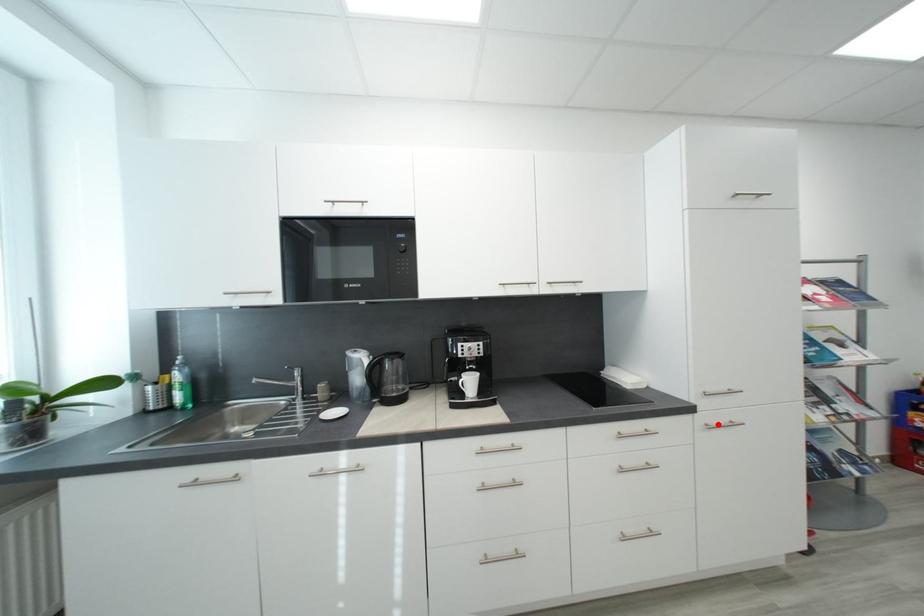
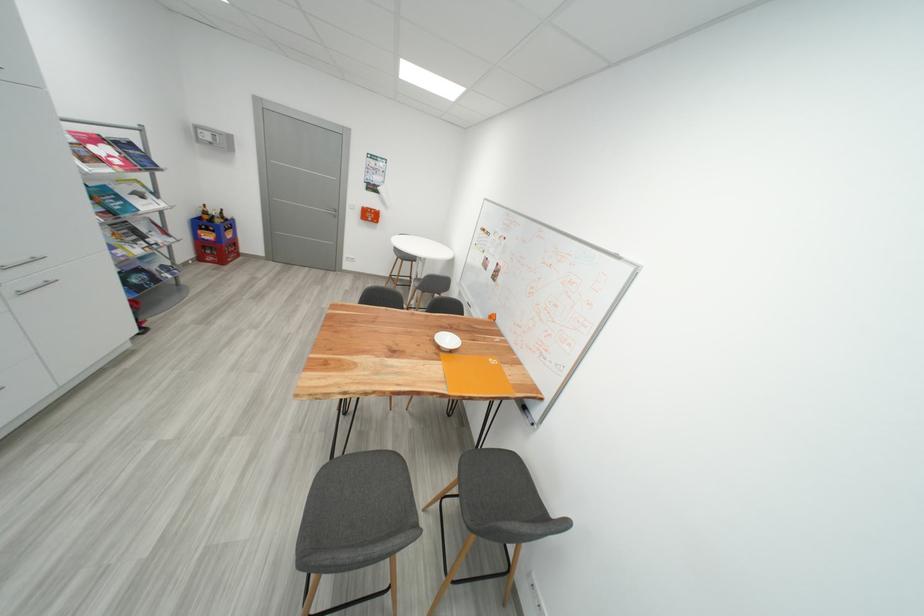
Question: I am providing you with two images of the same scene from different viewpoints. Image1 has a red point marked. In image2, the corresponding 3D location appears at what relative position? Reply with the corresponding letter.

Choices:
 (A) Closer
 (B) Farther

Answer: (B)